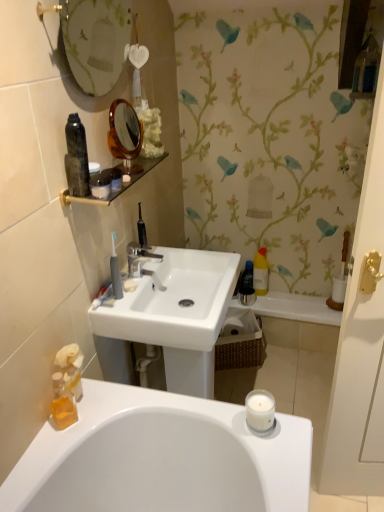
Question: Does matte glass mirror at upper center have a greater width compared to translucent orange soap at lower left, which ranks as the first toiletry in left-to-right order?

Choices:
 (A) yes
 (B) no

Answer: (A)

Question: Is matte glass mirror at upper center positioned with its back to translucent orange soap at lower left, which ranks as the first toiletry in left-to-right order?

Choices:
 (A) yes
 (B) no

Answer: (B)

Question: Does matte glass mirror at upper center have a greater height compared to translucent orange soap at lower left, the second toiletry positioned from the right?

Choices:
 (A) no
 (B) yes

Answer: (B)

Question: From a real-world perspective, is matte glass mirror at upper center located higher than translucent orange soap at lower left, which is the 2th toiletry in top-to-bottom order?

Choices:
 (A) no
 (B) yes

Answer: (B)

Question: Does matte glass mirror at upper center have a larger size compared to translucent orange soap at lower left, acting as the first toiletry starting from the bottom?

Choices:
 (A) no
 (B) yes

Answer: (B)

Question: Looking at their shapes, would you say white plastic toothbrush at left is wider or thinner than translucent orange soap at lower left, the second toiletry positioned from the right?

Choices:
 (A) wide
 (B) thin

Answer: (B)

Question: From a real-world perspective, is white plastic toothbrush at left above or below translucent orange soap at lower left, which ranks as the first toiletry in left-to-right order?

Choices:
 (A) above
 (B) below

Answer: (A)

Question: Is point (102, 301) positioned closer to the camera than point (66, 347)?

Choices:
 (A) closer
 (B) farther

Answer: (B)

Question: From the image's perspective, is white plastic toothbrush at left located above or below translucent orange soap at lower left, the second toiletry positioned from the right?

Choices:
 (A) below
 (B) above

Answer: (B)

Question: Is point (140, 220) closer or farther from the camera than point (110, 267)?

Choices:
 (A) farther
 (B) closer

Answer: (A)

Question: Would you say black plastic toothbrush at upper center, which appears as the 2th toiletries when viewed from the front, is to the left or to the right of gray plastic toothbrush at center, which appears as the 2th toiletries when viewed from the right, in the picture?

Choices:
 (A) left
 (B) right

Answer: (B)

Question: Is black plastic toothbrush at upper center, acting as the second toiletries starting from the left, in front of or behind gray plastic toothbrush at center, placed as the 1th toiletries when sorted from front to back, in the image?

Choices:
 (A) front
 (B) behind

Answer: (B)

Question: In terms of size, does black plastic toothbrush at upper center, the 1th toiletries positioned from the back, appear bigger or smaller than gray plastic toothbrush at center, which appears as the 2th toiletries when viewed from the right?

Choices:
 (A) small
 (B) big

Answer: (A)

Question: From their relative heights in the image, would you say white matte soap at upper center is taller or shorter than white plastic toothbrush at left?

Choices:
 (A) tall
 (B) short

Answer: (B)

Question: From a real-world perspective, is white matte soap at upper center positioned above or below white plastic toothbrush at left?

Choices:
 (A) below
 (B) above

Answer: (B)